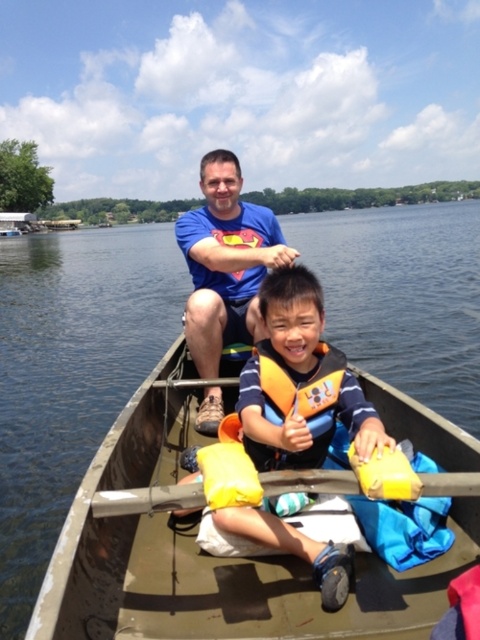
Question: Can you confirm if yellow foam life jacket at center is positioned to the right of yellow foam paddle at center?

Choices:
 (A) no
 (B) yes

Answer: (B)

Question: Is clear blue water at center thinner than orange life vest at center?

Choices:
 (A) no
 (B) yes

Answer: (A)

Question: Which object appears farthest from the camera in this image?

Choices:
 (A) matte blue shirt at center
 (B) clear blue water at center
 (C) yellow foam paddle at center
 (D) yellow foam life jacket at center

Answer: (B)

Question: Which point appears farthest from the camera in this image?

Choices:
 (A) (319, 488)
 (B) (298, 397)
 (C) (324, 372)

Answer: (C)

Question: Does clear blue water at center appear over yellow foam paddle at center?

Choices:
 (A) no
 (B) yes

Answer: (B)

Question: Which of the following is the closest to the observer?

Choices:
 (A) orange life vest at center
 (B) clear blue water at center
 (C) yellow foam life jacket at center

Answer: (A)